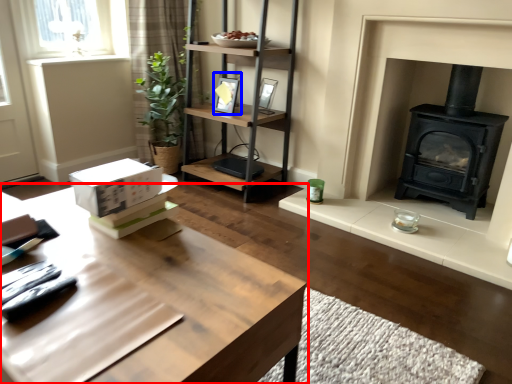
Question: Which object appears closest to the camera in this image, table (highlighted by a red box) or picture frame (highlighted by a blue box)?

Choices:
 (A) table
 (B) picture frame

Answer: (A)